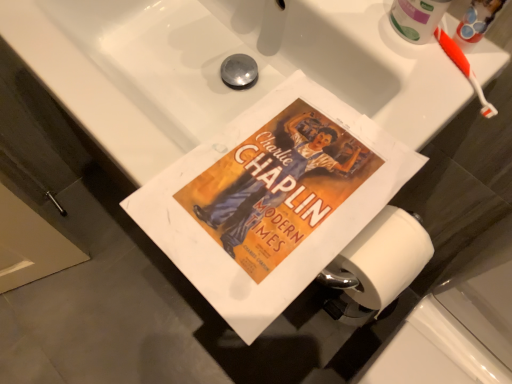
I want to click on free point below matte paper poster at center (from a real-world perspective), so click(x=276, y=177).